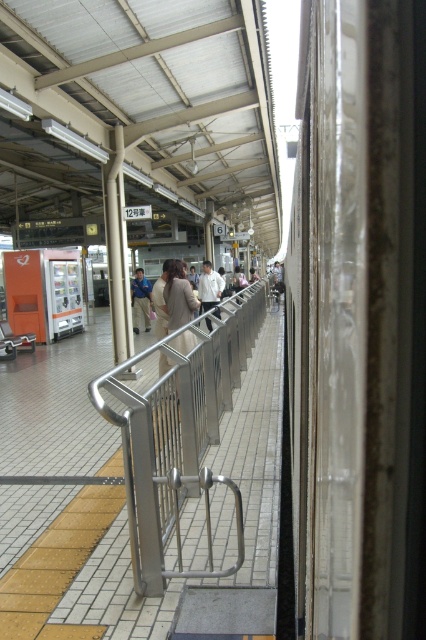
Looking at this image, between light brown fabric coat at center and white shirt at center, which one is positioned lower?

light brown fabric coat at center is lower down.

How distant is light brown fabric coat at center from white shirt at center?

light brown fabric coat at center is 6.20 meters from white shirt at center.

Is point (178, 310) positioned after point (210, 289)?

No, (178, 310) is closer to viewer.

This screenshot has height=640, width=426. I want to click on light brown fabric coat at center, so click(178, 296).

Based on the photo, can you confirm if white shirt at center is wider than light beige fabric jacket at center?

Incorrect, white shirt at center's width does not surpass light beige fabric jacket at center's.

Find the location of a particular element. The height and width of the screenshot is (640, 426). white shirt at center is located at coordinates (210, 289).

Does point (178, 282) come in front of point (149, 280)?

Yes, it is.

Is light brown fabric coat at center thinner than light beige fabric jacket at center?

Correct, light brown fabric coat at center's width is less than light beige fabric jacket at center's.

Is point (170, 264) closer to camera compared to point (137, 284)?

Yes, it is.

You are a GUI agent. You are given a task and a screenshot of the screen. Output one action in this format:
    pyautogui.click(x=<x>, y=<y>)
    Task: Click on the light brown fabric coat at center
    
    Given the screenshot: What is the action you would take?
    pyautogui.click(x=178, y=296)